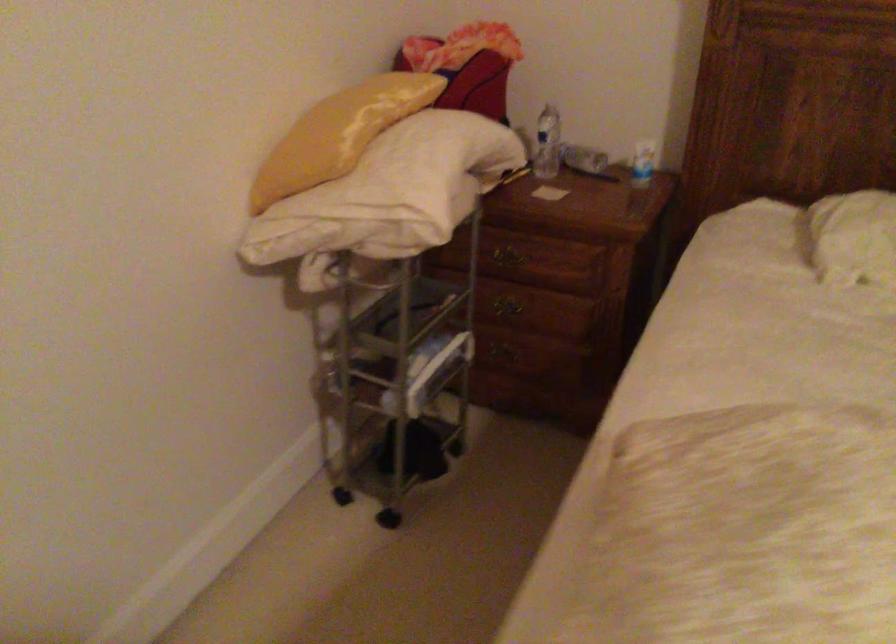
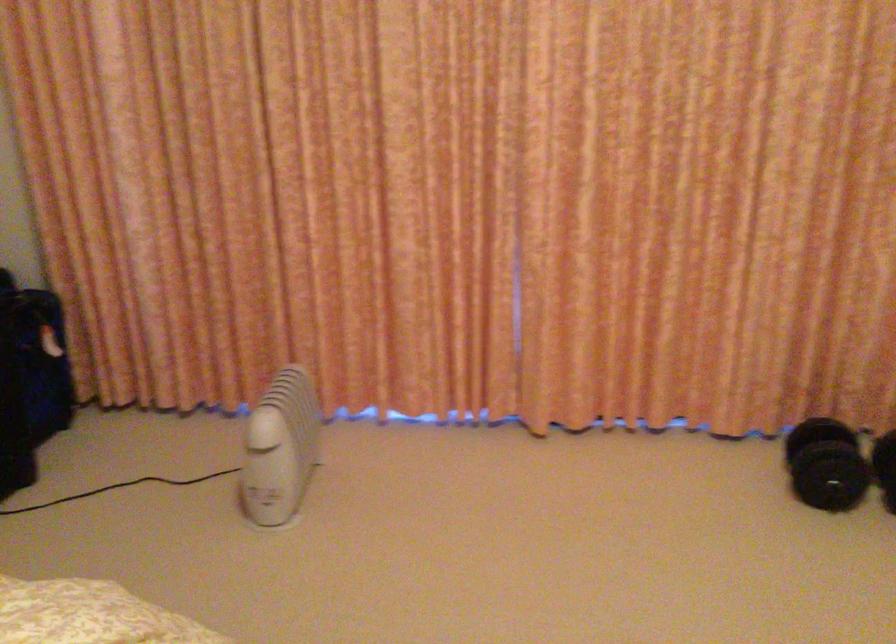
How did the camera likely rotate?

The camera's rotation is toward right-down.